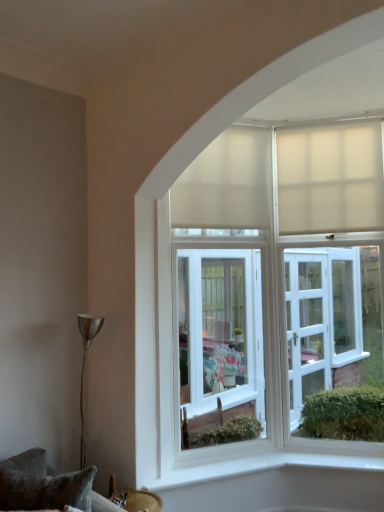
Question: Should I look upward or downward to see white matte curtain at upper center, which is the 2th curtain in right-to-left order?

Choices:
 (A) down
 (B) up

Answer: (B)

Question: From the image's perspective, is white matte curtain at upper center, which is the 2th curtain in right-to-left order, on top of beige matte curtain at upper right, which is the first curtain from right to left?

Choices:
 (A) no
 (B) yes

Answer: (B)

Question: Does white matte curtain at upper center, which is the 2th curtain in right-to-left order, lie in front of beige matte curtain at upper right, the second curtain viewed from the left?

Choices:
 (A) yes
 (B) no

Answer: (A)

Question: Is white matte curtain at upper center, which is the first curtain from left to right, next to beige matte curtain at upper right, which is the first curtain from right to left, and touching it?

Choices:
 (A) no
 (B) yes

Answer: (A)

Question: Is white matte curtain at upper center, which is the 2th curtain in right-to-left order, bigger than beige matte curtain at upper right, which is the first curtain from right to left?

Choices:
 (A) yes
 (B) no

Answer: (A)

Question: From a real-world perspective, is white matte curtain at upper center, which is the first curtain from left to right, below beige matte curtain at upper right, which is the first curtain from right to left?

Choices:
 (A) no
 (B) yes

Answer: (A)

Question: Can you confirm if white matte curtain at upper center, which is the first curtain from left to right, is taller than beige matte curtain at upper right, which is the first curtain from right to left?

Choices:
 (A) no
 (B) yes

Answer: (B)

Question: Does velvet cushion at lower left have a larger size compared to white matte curtain at upper center, which is the first curtain from left to right?

Choices:
 (A) no
 (B) yes

Answer: (A)

Question: Does velvet cushion at lower left lie in front of white matte curtain at upper center, which is the 2th curtain in right-to-left order?

Choices:
 (A) no
 (B) yes

Answer: (B)

Question: From a real-world perspective, is velvet cushion at lower left physically above white matte curtain at upper center, which is the first curtain from left to right?

Choices:
 (A) no
 (B) yes

Answer: (A)

Question: Considering the relative positions of velvet cushion at lower left and white matte curtain at upper center, which is the 2th curtain in right-to-left order, in the image provided, is velvet cushion at lower left to the left of white matte curtain at upper center, which is the 2th curtain in right-to-left order, from the viewer's perspective?

Choices:
 (A) no
 (B) yes

Answer: (B)

Question: Is velvet cushion at lower left outside white matte curtain at upper center, which is the first curtain from left to right?

Choices:
 (A) no
 (B) yes

Answer: (B)

Question: Is velvet cushion at lower left smaller than white matte curtain at upper center, which is the 2th curtain in right-to-left order?

Choices:
 (A) no
 (B) yes

Answer: (B)

Question: Can you confirm if velvet cushion at lower left is thinner than beige matte curtain at upper right, which is the first curtain from right to left?

Choices:
 (A) yes
 (B) no

Answer: (B)